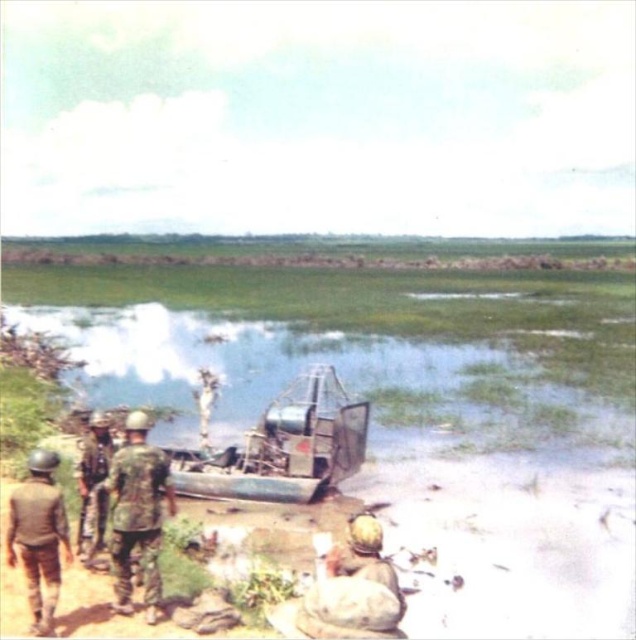
Looking at this image, based on the provided scene description, where is the green grassy water at center located in the image?

The green grassy water at center is located at point (342, 380) in the image.

You are a soldier in the marsh area and need to retrieve an item from the muddy ground. Which item would you need to move first, the camouflage fabric uniform at left or the camouflage fabric helmet at lower left?

The camouflage fabric uniform at left is positioned over the camouflage fabric helmet at lower left, so you would need to move the camouflage fabric uniform at left first to access the helmet.